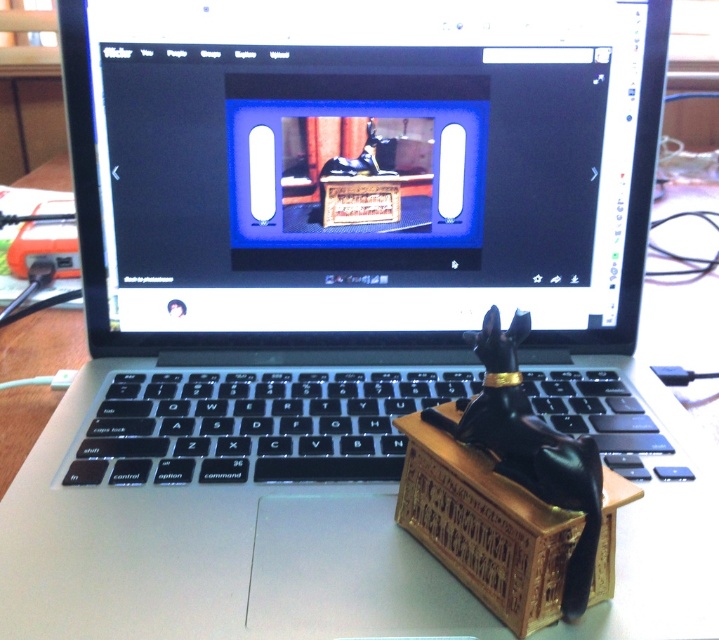
You are organizing items on your desk and need to place a new item between the black plastic keyboard at center and the gold carved wooden crate at center. Which item should you place closer to the keyboard to maintain the height order?

Since the black plastic keyboard at center is shorter than the gold carved wooden crate at center, you should place the new item closer to the keyboard to maintain the height order.

You are trying to locate the black plastic keyboard at center in the image. According to the coordinates provided, where exactly is it positioned?

The black plastic keyboard at center is located at point coordinates of (x=255, y=426).